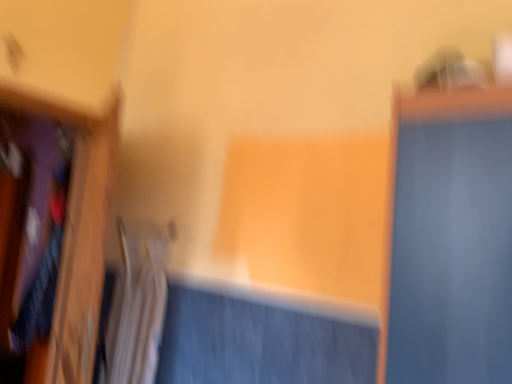
Question: Is white fabric radiator at lower left surrounded by wooden frame at left?

Choices:
 (A) yes
 (B) no

Answer: (B)

Question: Considering the relative sizes of wooden frame at left and white fabric radiator at lower left in the image provided, is wooden frame at left shorter than white fabric radiator at lower left?

Choices:
 (A) yes
 (B) no

Answer: (B)

Question: Are wooden frame at left and white fabric radiator at lower left making contact?

Choices:
 (A) no
 (B) yes

Answer: (A)

Question: Is the position of wooden frame at left less distant than that of white fabric radiator at lower left?

Choices:
 (A) no
 (B) yes

Answer: (B)

Question: Does wooden frame at left come behind white fabric radiator at lower left?

Choices:
 (A) no
 (B) yes

Answer: (A)

Question: Can you confirm if wooden frame at left is thinner than white fabric radiator at lower left?

Choices:
 (A) no
 (B) yes

Answer: (B)

Question: Would you say white fabric radiator at lower left contains velvet-like fabric shirt at left?

Choices:
 (A) no
 (B) yes

Answer: (A)

Question: Is white fabric radiator at lower left bigger than velvet-like fabric shirt at left?

Choices:
 (A) yes
 (B) no

Answer: (B)

Question: From the image's perspective, is white fabric radiator at lower left located beneath velvet-like fabric shirt at left?

Choices:
 (A) no
 (B) yes

Answer: (A)

Question: Is white fabric radiator at lower left smaller than velvet-like fabric shirt at left?

Choices:
 (A) no
 (B) yes

Answer: (B)

Question: Does white fabric radiator at lower left appear on the left side of velvet-like fabric shirt at left?

Choices:
 (A) yes
 (B) no

Answer: (B)

Question: Is white fabric radiator at lower left positioned beyond the bounds of velvet-like fabric shirt at left?

Choices:
 (A) yes
 (B) no

Answer: (A)

Question: Considering the relative sizes of wooden frame at left and velvet-like fabric shirt at left in the image provided, is wooden frame at left taller than velvet-like fabric shirt at left?

Choices:
 (A) no
 (B) yes

Answer: (B)